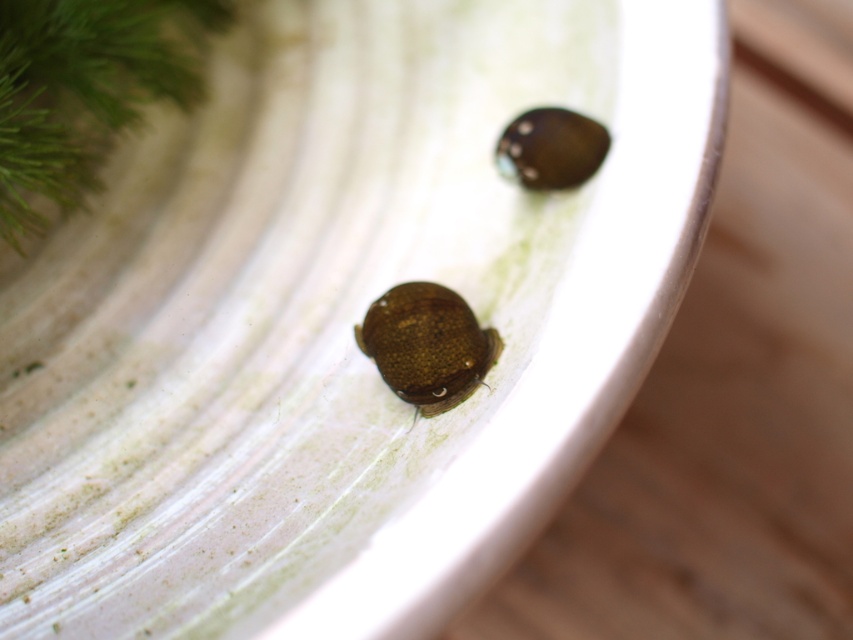
Is green leafy dill at upper left positioned behind brown matte beetle at center?

No, it is not.

Is green leafy dill at upper left positioned in front of brown matte beetle at center?

That is True.

The image size is (853, 640). What do you see at coordinates (86, 90) in the screenshot?
I see `green leafy dill at upper left` at bounding box center [86, 90].

Where is `green leafy dill at upper left`? This screenshot has width=853, height=640. green leafy dill at upper left is located at coordinates (86, 90).